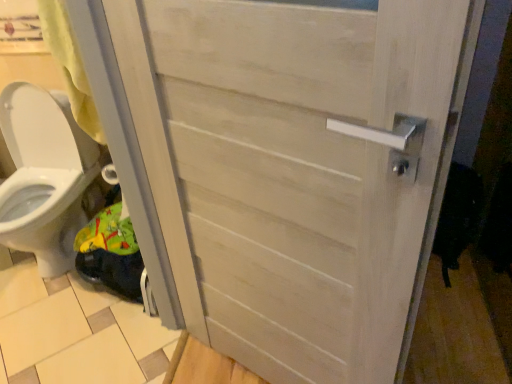
Question: Can you confirm if beige wood tile at lower left is shorter than white glossy toilet at lower left?

Choices:
 (A) yes
 (B) no

Answer: (A)

Question: Is beige wood tile at lower left located outside white glossy toilet at lower left?

Choices:
 (A) no
 (B) yes

Answer: (B)

Question: From the image's perspective, is beige wood tile at lower left below white glossy toilet at lower left?

Choices:
 (A) yes
 (B) no

Answer: (A)

Question: From a real-world perspective, is beige wood tile at lower left located higher than white glossy toilet at lower left?

Choices:
 (A) no
 (B) yes

Answer: (A)

Question: Considering the relative sizes of beige wood tile at lower left and white glossy toilet at lower left in the image provided, is beige wood tile at lower left smaller than white glossy toilet at lower left?

Choices:
 (A) yes
 (B) no

Answer: (A)

Question: Does beige wood tile at lower left lie behind white glossy toilet at lower left?

Choices:
 (A) yes
 (B) no

Answer: (A)

Question: Does white wood door at center have a lesser height compared to beige wood tile at lower left?

Choices:
 (A) yes
 (B) no

Answer: (B)

Question: From a real-world perspective, is white wood door at center on top of beige wood tile at lower left?

Choices:
 (A) yes
 (B) no

Answer: (A)

Question: From the image's perspective, is white wood door at center below beige wood tile at lower left?

Choices:
 (A) yes
 (B) no

Answer: (B)

Question: Would you say white wood door at center is a long distance from beige wood tile at lower left?

Choices:
 (A) yes
 (B) no

Answer: (B)

Question: Is white wood door at center looking in the opposite direction of beige wood tile at lower left?

Choices:
 (A) yes
 (B) no

Answer: (B)

Question: Considering the relative sizes of white wood door at center and beige wood tile at lower left in the image provided, is white wood door at center wider than beige wood tile at lower left?

Choices:
 (A) no
 (B) yes

Answer: (A)

Question: Considering the relative positions of white glossy toilet at lower left and beige wood tile at lower left in the image provided, is white glossy toilet at lower left to the right of beige wood tile at lower left from the viewer's perspective?

Choices:
 (A) no
 (B) yes

Answer: (A)